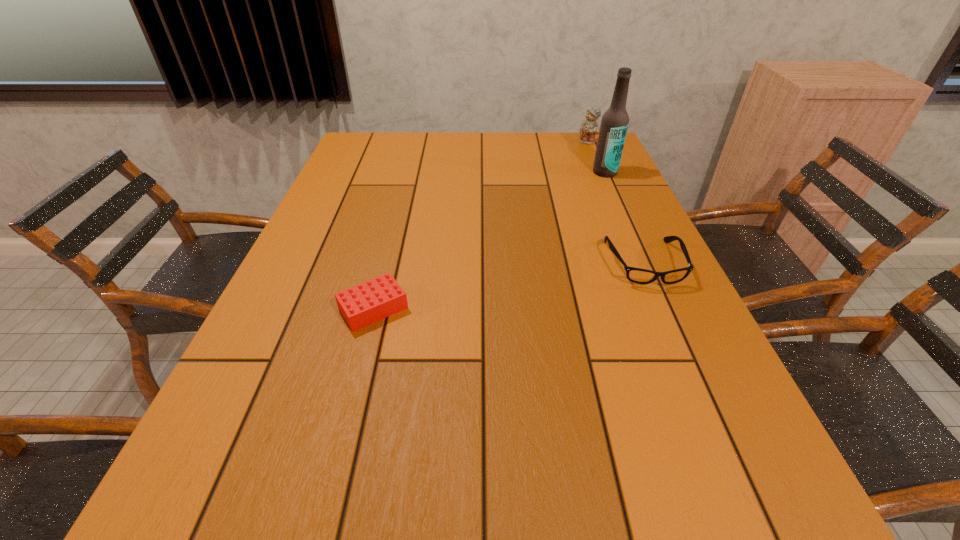
Locate an element on the screen. vacant area between the farthest object and the spectacles is located at coordinates (615, 202).

Identify the location of vacant area that lies between the leftmost object and the spectacles. (509, 286).

Locate an element on the screen. This screenshot has width=960, height=540. vacant area between the spectacles and the Lego is located at coordinates (509, 286).

Identify the location of the closest object to the second farthest object. Image resolution: width=960 pixels, height=540 pixels. (589, 128).

Select which object appears as the second closest to the tallest object. Please provide its 2D coordinates. Your answer should be formatted as a tuple, i.e. [(x, y)], where the tuple contains the x and y coordinates of a point satisfying the conditions above.

[(636, 275)]